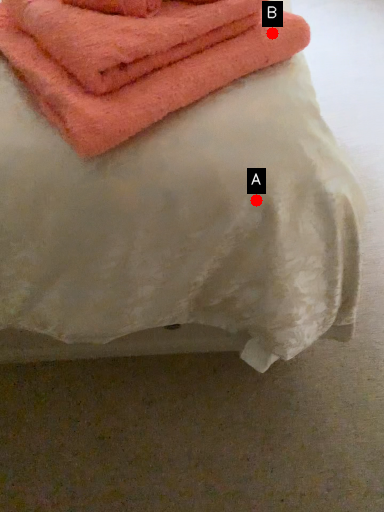
Question: Two points are circled on the image, labeled by A and B beside each circle. Which point is closer to the camera taking this photo?

Choices:
 (A) A is closer
 (B) B is closer

Answer: (A)